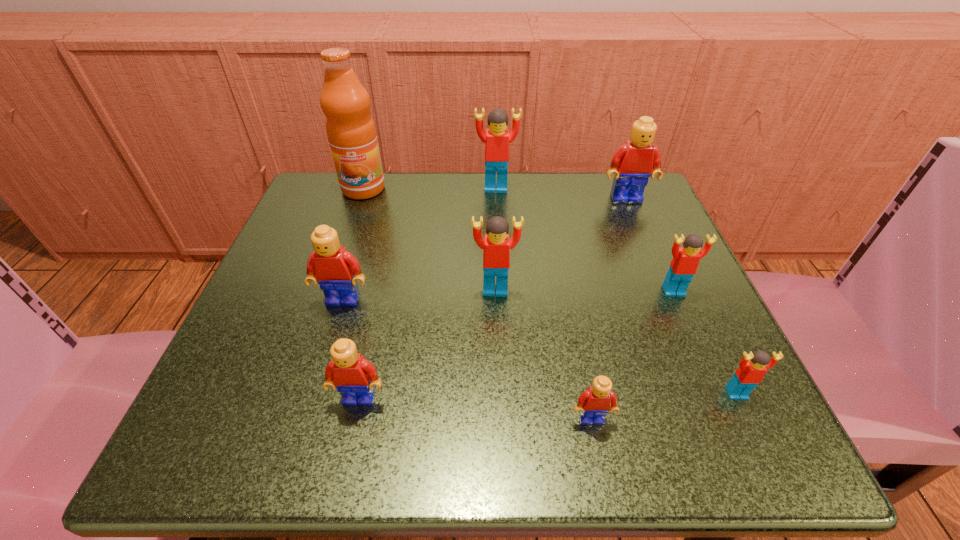
The height and width of the screenshot is (540, 960). What are the coordinates of `the nearest Lego` in the screenshot? It's located at (594, 404).

You are a GUI agent. You are given a task and a screenshot of the screen. Output one action in this format:
    pyautogui.click(x=<x>, y=<y>)
    Task: Click on the vacant position located on the label side of the fruit juice
    This screenshot has width=960, height=540.
    Given the screenshot: What is the action you would take?
    pyautogui.click(x=344, y=246)

Find the location of a particular element. The height and width of the screenshot is (540, 960). vacant space located 0.130m on the face of the farthest red Lego is located at coordinates (498, 230).

Locate an element on the screen. The image size is (960, 540). free region located 0.350m on the front-facing side of the biggest yellow Lego is located at coordinates (683, 333).

At what (x,y) coordinates should I click in order to perform the action: click on vacant space situated 0.100m on the face of the second biggest red Lego. Please return your answer as a coordinate pair (x, y). The image size is (960, 540). Looking at the image, I should click on (497, 345).

I want to click on vacant space located on the front-facing side of the third smallest yellow Lego, so click(x=315, y=394).

The image size is (960, 540). I want to click on free point located 0.270m on the face of the second smallest red Lego, so click(x=745, y=454).

Identify the location of vacant position located on the face of the smallest red Lego. This screenshot has height=540, width=960. (756, 435).

Locate an element on the screen. This screenshot has width=960, height=540. fruit juice at the far edge is located at coordinates (351, 132).

Where is `fruit juice present at the left edge`? fruit juice present at the left edge is located at coordinates (351, 132).